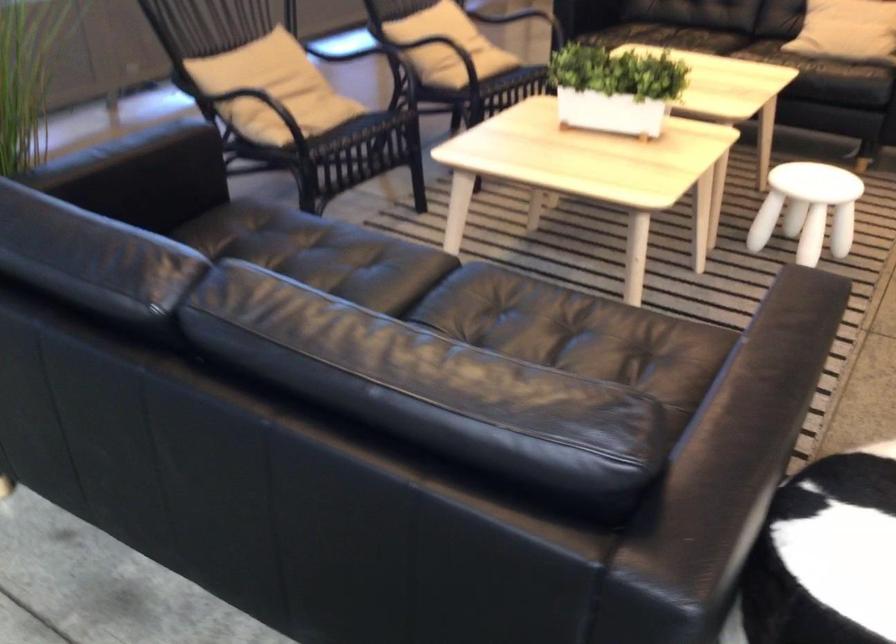
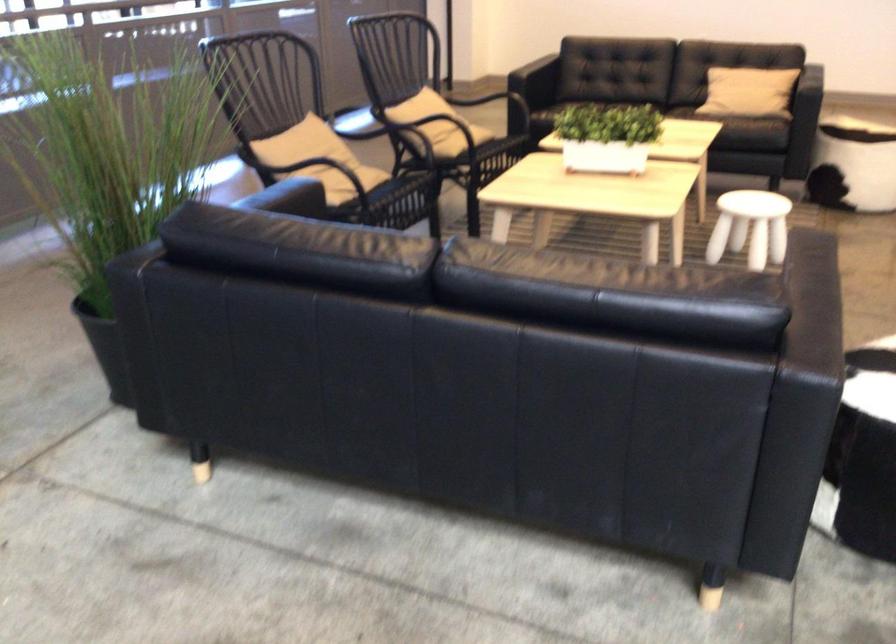
In the second image, find the point that corresponds to point (794, 216) in the first image.

(750, 227)